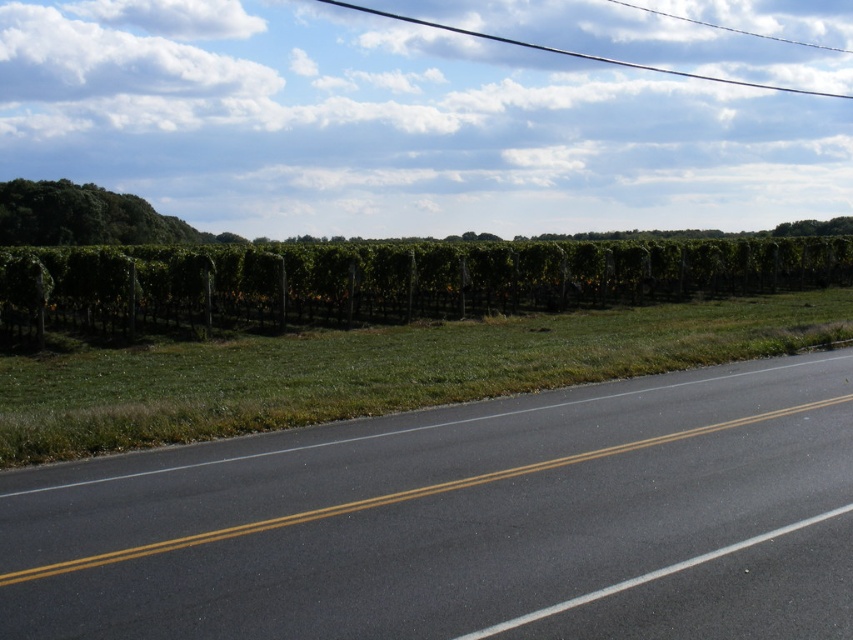
Consider the image. Is green leafy hedge at upper center closer to the viewer compared to green leafy tree at upper right?

Yes.

Does green leafy hedge at upper center have a smaller size compared to green leafy tree at upper right?

Yes, green leafy hedge at upper center is smaller than green leafy tree at upper right.

You are a GUI agent. You are given a task and a screenshot of the screen. Output one action in this format:
    pyautogui.click(x=<x>, y=<y>)
    Task: Click on the green leafy hedge at upper center
    
    Given the screenshot: What is the action you would take?
    pyautogui.click(x=383, y=282)

Where is `green leafy hedge at upper center`? The image size is (853, 640). green leafy hedge at upper center is located at coordinates point(383,282).

Is point (556, 504) behind point (804, 228)?

No, (556, 504) is closer to viewer.

Who is more forward, (x=351, y=502) or (x=813, y=225)?

Point (x=351, y=502) is more forward.

Measure the distance between black asphalt highway at center and camera.

black asphalt highway at center and camera are 14.50 feet apart.

Locate an element on the screen. Image resolution: width=853 pixels, height=640 pixels. black asphalt highway at center is located at coordinates (465, 522).

Which is below, green leafy hedge at upper center or green leafy tree at upper left?

green leafy hedge at upper center is lower down.

Between green leafy hedge at upper center and green leafy tree at upper left, which one is positioned higher?

green leafy tree at upper left is higher up.

Describe the element at coordinates (383, 282) in the screenshot. I see `green leafy hedge at upper center` at that location.

Locate an element on the screen. The width and height of the screenshot is (853, 640). green leafy hedge at upper center is located at coordinates (383, 282).